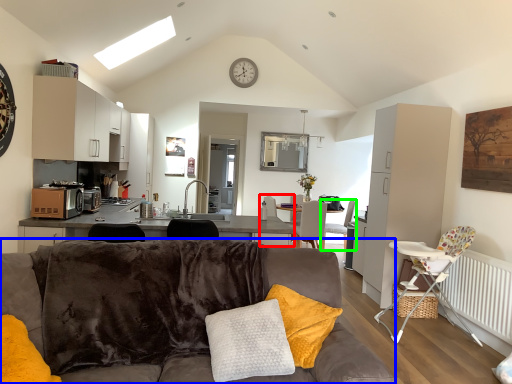
Question: Based on their relative distances, which object is farther from armchair (highlighted by a red box)? Choose from studio couch (highlighted by a blue box) and chair (highlighted by a green box).

Choices:
 (A) studio couch
 (B) chair

Answer: (A)